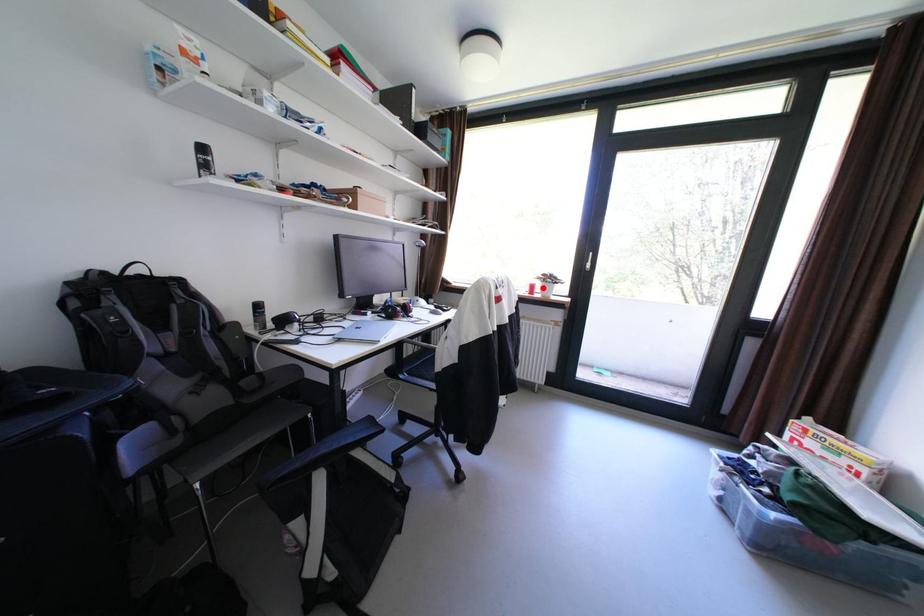
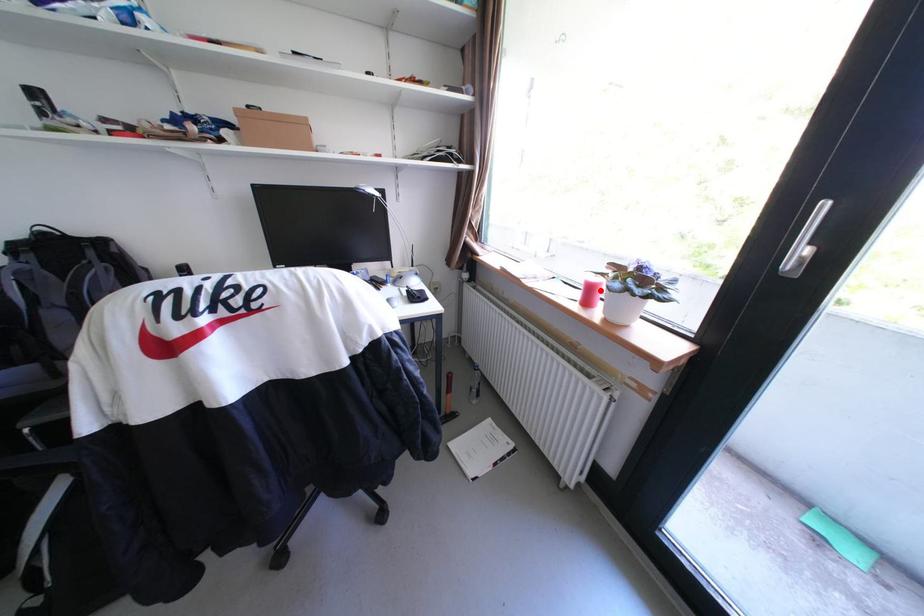
I am providing you with two images of the same scene from different viewpoints. A red point is marked on the first image and another point is marked on the second image. Are the points marked in image1 and image2 representing the same 3D position?

Yes